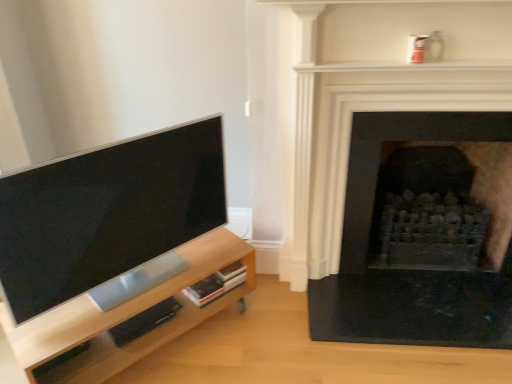
Question: Does black stone fireplace at right, the first fireplace positioned from the back, have a lesser width compared to black stone fireplace at right, which appears as the 1th fireplace when viewed from the front?

Choices:
 (A) no
 (B) yes

Answer: (A)

Question: Can you confirm if black stone fireplace at right, the first fireplace positioned from the back, is taller than black stone fireplace at right, marked as the 2th fireplace in a back-to-front arrangement?

Choices:
 (A) no
 (B) yes

Answer: (A)

Question: Does black stone fireplace at right, the second fireplace positioned from the front, turn towards black stone fireplace at right, marked as the 2th fireplace in a back-to-front arrangement?

Choices:
 (A) yes
 (B) no

Answer: (A)

Question: From the image's perspective, is black stone fireplace at right, the second fireplace positioned from the front, on black stone fireplace at right, marked as the 2th fireplace in a back-to-front arrangement?

Choices:
 (A) yes
 (B) no

Answer: (B)

Question: Is black stone fireplace at right, the second fireplace positioned from the front, oriented away from black stone fireplace at right, marked as the 2th fireplace in a back-to-front arrangement?

Choices:
 (A) yes
 (B) no

Answer: (A)

Question: From a real-world perspective, relative to black stone fireplace at right, which appears as the 1th fireplace when viewed from the front, is black stone fireplace at right, the second fireplace positioned from the front, vertically above or below?

Choices:
 (A) below
 (B) above

Answer: (A)

Question: Is point [x=362, y=251] closer or farther from the camera than point [x=421, y=188]?

Choices:
 (A) farther
 (B) closer

Answer: (B)

Question: Is black stone fireplace at right, the first fireplace positioned from the back, to the left or to the right of black stone fireplace at right, which appears as the 1th fireplace when viewed from the front, in the image?

Choices:
 (A) left
 (B) right

Answer: (B)

Question: Is black stone fireplace at right, the second fireplace positioned from the front, situated inside black stone fireplace at right, marked as the 2th fireplace in a back-to-front arrangement, or outside?

Choices:
 (A) outside
 (B) inside

Answer: (A)

Question: From the image's perspective, is black stone fireplace at right, the second fireplace positioned from the front, located above or below light wood entertainment center at left?

Choices:
 (A) above
 (B) below

Answer: (A)

Question: Is point (377, 142) closer or farther from the camera than point (11, 332)?

Choices:
 (A) closer
 (B) farther

Answer: (B)

Question: Considering their positions, is black stone fireplace at right, the second fireplace positioned from the front, located in front of or behind light wood entertainment center at left?

Choices:
 (A) front
 (B) behind

Answer: (B)

Question: Considering the relative positions of black stone fireplace at right, the second fireplace positioned from the front, and light wood entertainment center at left in the image provided, is black stone fireplace at right, the second fireplace positioned from the front, to the left or to the right of light wood entertainment center at left?

Choices:
 (A) left
 (B) right

Answer: (B)

Question: From a real-world perspective, relative to black stone fireplace at right, marked as the 2th fireplace in a back-to-front arrangement, is light wood entertainment center at left vertically above or below?

Choices:
 (A) below
 (B) above

Answer: (A)

Question: Is light wood entertainment center at left in front of or behind black stone fireplace at right, marked as the 2th fireplace in a back-to-front arrangement, in the image?

Choices:
 (A) behind
 (B) front

Answer: (B)